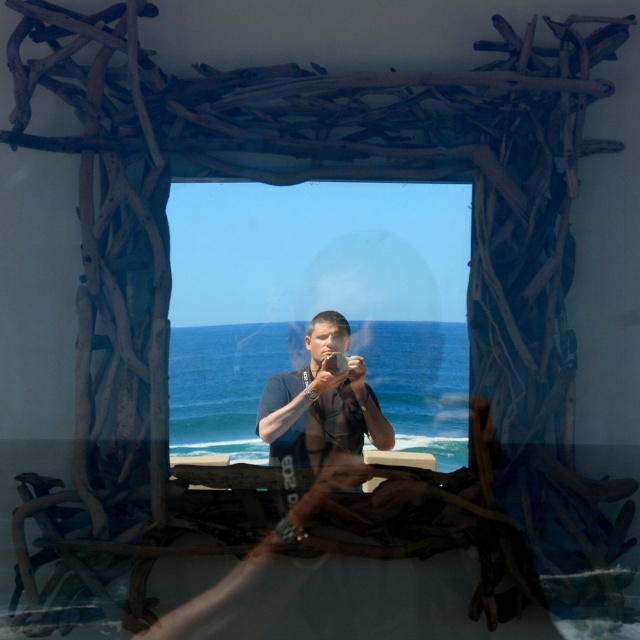
Question: Does transparent glass window at center have a lesser width compared to dark blue fabric at center?

Choices:
 (A) yes
 (B) no

Answer: (B)

Question: Which object appears closest to the camera in this image?

Choices:
 (A) dark blue fabric at center
 (B) transparent glass window at center

Answer: (A)

Question: Can you confirm if transparent glass window at center is positioned to the left of dark blue fabric at center?

Choices:
 (A) yes
 (B) no

Answer: (A)

Question: Is transparent glass window at center closer to the viewer compared to dark blue fabric at center?

Choices:
 (A) no
 (B) yes

Answer: (A)

Question: Which of the following is the closest to the observer?

Choices:
 (A) dark blue fabric at center
 (B) transparent glass window at center

Answer: (A)